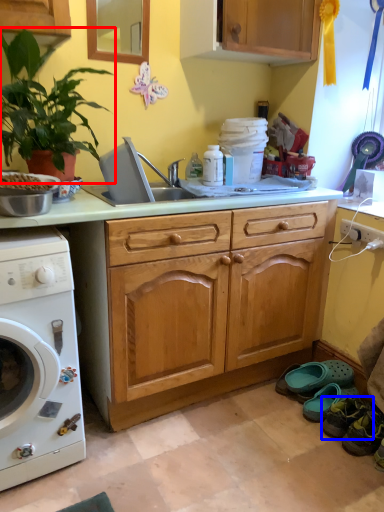
Question: Which object is closer to the camera taking this photo, houseplant (highlighted by a red box) or shoe (highlighted by a blue box)?

Choices:
 (A) houseplant
 (B) shoe

Answer: (A)